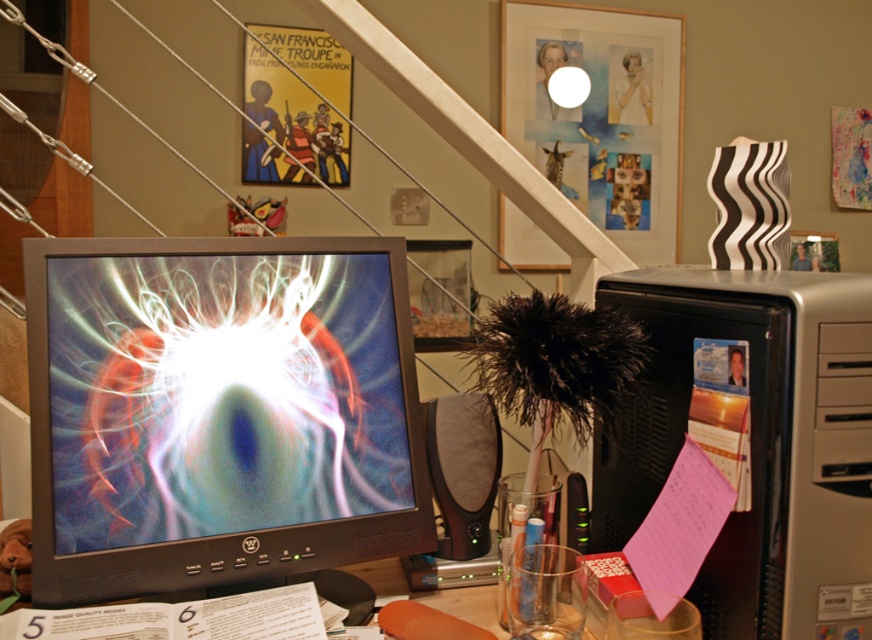
You are organizing your desk and need to place a new keyboard. The keyboard requires a space of 12 inches in width. Can the area next to the matte black monitor at center accommodate it?

The matte black monitor at center is located at point (218, 412), but without specific spatial dimensions or distances between objects, it is impossible to determine if the area next to it has enough space for the keyboard.

You are standing in front of the desk and want to reach the point at coordinates point (69, 493). If your arm can extend 30 inches, can you reach it?

The point (69, 493) is 31.90 inches away from the viewer, which is slightly beyond the arm extension of 30 inches. Therefore, you cannot reach it with your arm.

You are organizing cables for a desk setup. You have a 15 inch long cable that needs to connect the matte black monitor at center to the silver metallic computer tower at right. Based on the image, will the cable be long enough?

The distance between the matte black monitor at center and the silver metallic computer tower at right is 16.33 inches. Since the cable is only 15 inches long, it will not be sufficient to reach the connection point.